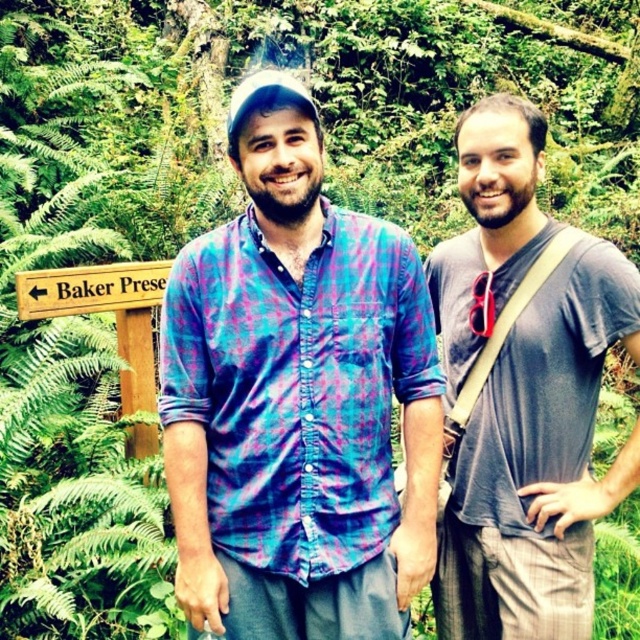
Is plaid fabric shirt at center wider than wooden sign at left?

Indeed, plaid fabric shirt at center has a greater width compared to wooden sign at left.

Between point (225, 493) and point (120, 272), which one is positioned behind?

The point (120, 272) is more distant.

Does point (164, 432) lie behind point (88, 289)?

No, it is not.

Where is `plaid fabric shirt at center`? The width and height of the screenshot is (640, 640). plaid fabric shirt at center is located at coordinates (296, 397).

Can you confirm if plaid fabric shirt at center is thinner than gray cotton t-shirt at right?

In fact, plaid fabric shirt at center might be wider than gray cotton t-shirt at right.

From the picture: Who is higher up, plaid fabric shirt at center or gray cotton t-shirt at right?

plaid fabric shirt at center is above.

Which is in front, point (340, 563) or point (524, 512)?

Positioned in front is point (340, 563).

I want to click on plaid fabric shirt at center, so click(x=296, y=397).

Which is in front, point (452, 301) or point (83, 282)?

Positioned in front is point (452, 301).

Is point (531, 330) farther from camera compared to point (20, 305)?

That is False.

Locate an element on the screen. This screenshot has width=640, height=640. gray cotton t-shirt at right is located at coordinates (538, 461).